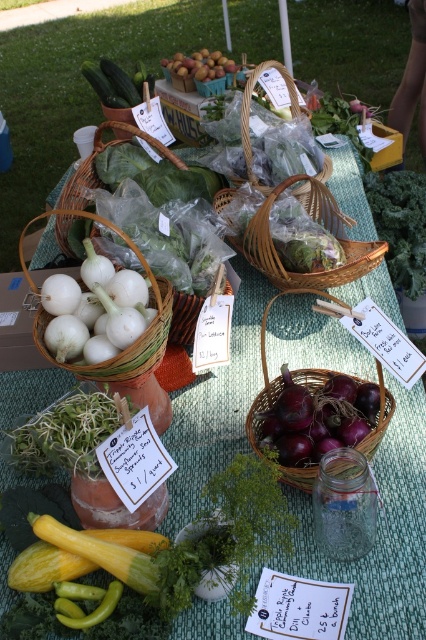
You are a customer at the market and want to place the smooth yellow squash at center into the white woven basket at center. Can the squash fit inside the basket based on their sizes?

The white woven basket at center is taller than the smooth yellow squash at center, so the squash can fit inside the basket.

You are a customer at the market and want to place the smooth yellow squash at center into the white woven basket at center. Can the squash fit inside the basket based on their sizes?

The white woven basket at center has a larger width than the smooth yellow squash at center, so the squash can fit inside the basket.

You are navigating through the market and want to reach the point at the back of the display. Which of the two points, point (348,273) or point (115,598), should you head towards?

You should head towards point (348,273) because it is behind point (115,598), making it the point at the back of the display.